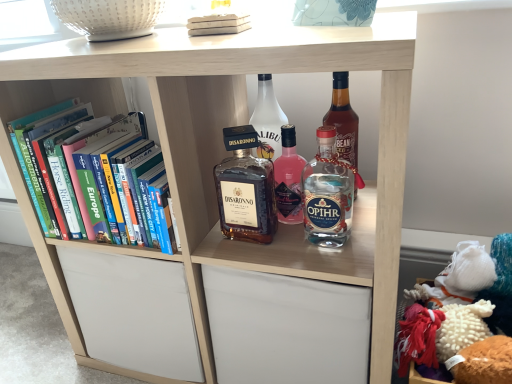
You are a GUI agent. You are given a task and a screenshot of the screen. Output one action in this format:
    pyautogui.click(x=<x>, y=<y>)
    Task: Click on the free space in front of white matte book at upper center, the first book positioned from the front
    
    Given the screenshot: What is the action you would take?
    pyautogui.click(x=249, y=38)